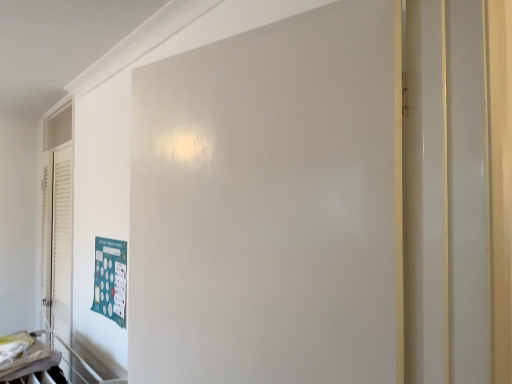
Question: Does point (210, 244) appear closer or farther from the camera than point (100, 276)?

Choices:
 (A) farther
 (B) closer

Answer: (B)

Question: Is white matte door at center taller or shorter than teal matte poster at lower left?

Choices:
 (A) short
 (B) tall

Answer: (B)

Question: From the image's perspective, is white matte door at center above or below teal matte poster at lower left?

Choices:
 (A) above
 (B) below

Answer: (A)

Question: Considering the relative positions of teal matte poster at lower left and white matte door at center in the image provided, is teal matte poster at lower left to the left or to the right of white matte door at center?

Choices:
 (A) left
 (B) right

Answer: (A)

Question: From the image's perspective, is teal matte poster at lower left above or below white matte door at center?

Choices:
 (A) above
 (B) below

Answer: (B)

Question: In terms of size, does teal matte poster at lower left appear bigger or smaller than white matte door at center?

Choices:
 (A) big
 (B) small

Answer: (B)

Question: From a real-world perspective, is teal matte poster at lower left above or below white matte door at center?

Choices:
 (A) above
 (B) below

Answer: (B)